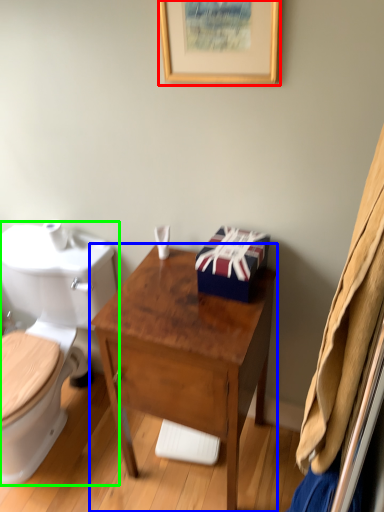
Question: Which is nearer to the picture frame (highlighted by a red box)? desk (highlighted by a blue box) or toilet (highlighted by a green box).

Choices:
 (A) desk
 (B) toilet

Answer: (A)